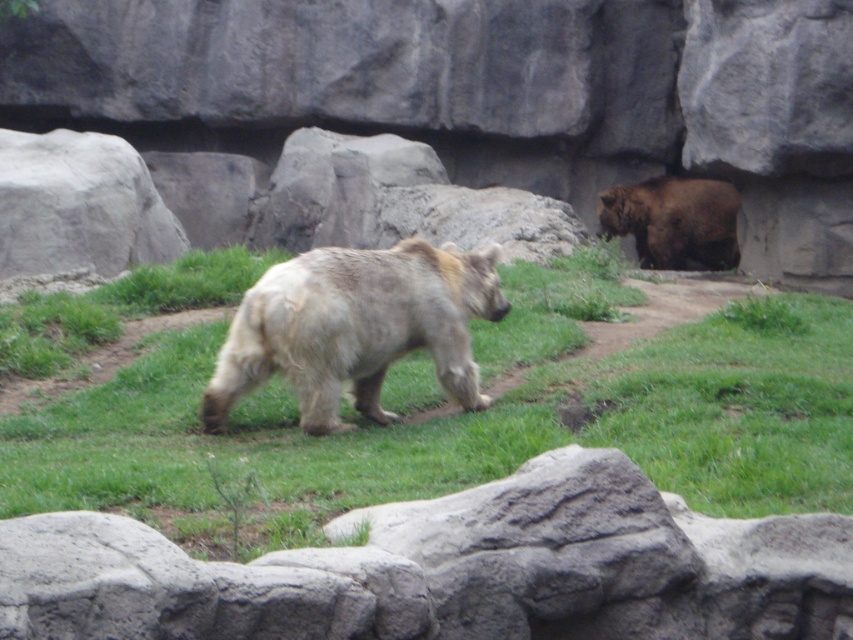
Question: Among these points, which one is farthest from the camera?

Choices:
 (A) (265, 412)
 (B) (209, 33)

Answer: (B)

Question: Which point appears farthest from the camera in this image?

Choices:
 (A) (663, 177)
 (B) (445, 369)
 (C) (738, 470)

Answer: (A)

Question: Is gray rock at center behind brown furry bear at right?

Choices:
 (A) yes
 (B) no

Answer: (B)

Question: Which of the following is the closest to the observer?

Choices:
 (A) gray rough rock at center
 (B) brown furry bear at right

Answer: (A)

Question: Can you confirm if gray rough rock at center is positioned to the left of brown furry bear at right?

Choices:
 (A) yes
 (B) no

Answer: (A)

Question: Can you confirm if green grassy at center is bigger than gray rough rock at center?

Choices:
 (A) no
 (B) yes

Answer: (A)